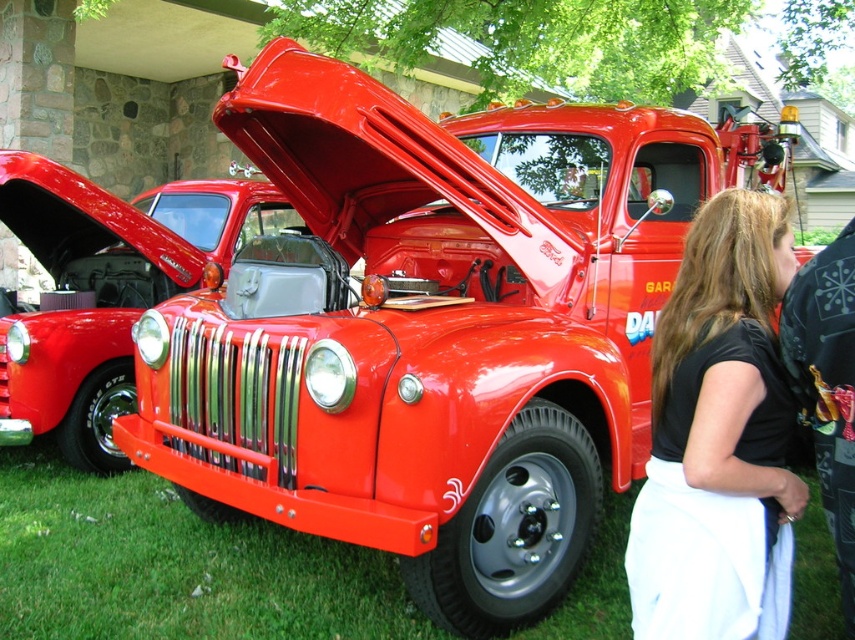
Does green grass at lower left have a larger size compared to shiny chrome grill at center?

Incorrect, green grass at lower left is not larger than shiny chrome grill at center.

Who is more distant from viewer, (56,522) or (25,412)?

Positioned behind is point (25,412).

Locate an element on the screen. The height and width of the screenshot is (640, 855). green grass at lower left is located at coordinates (175, 566).

The height and width of the screenshot is (640, 855). I want to click on green grass at lower left, so click(x=175, y=566).

Based on the photo, is the position of black fabric skirt at lower right less distant than that of shiny chrome grill at center?

Yes.

Who is positioned more to the left, black fabric skirt at lower right or shiny chrome grill at center?

shiny chrome grill at center is more to the left.

Who is more distant from viewer, (738, 241) or (166, 230)?

The point (166, 230) is behind.

This screenshot has width=855, height=640. I want to click on black fabric skirt at lower right, so click(718, 436).

Is green grass at lower left bigger than shiny metallic car at center?

Indeed, green grass at lower left has a larger size compared to shiny metallic car at center.

Who is more distant from viewer, (588,566) or (812,260)?

The point (588,566) is behind.

Image resolution: width=855 pixels, height=640 pixels. What are the coordinates of `green grass at lower left` in the screenshot? It's located at (175, 566).